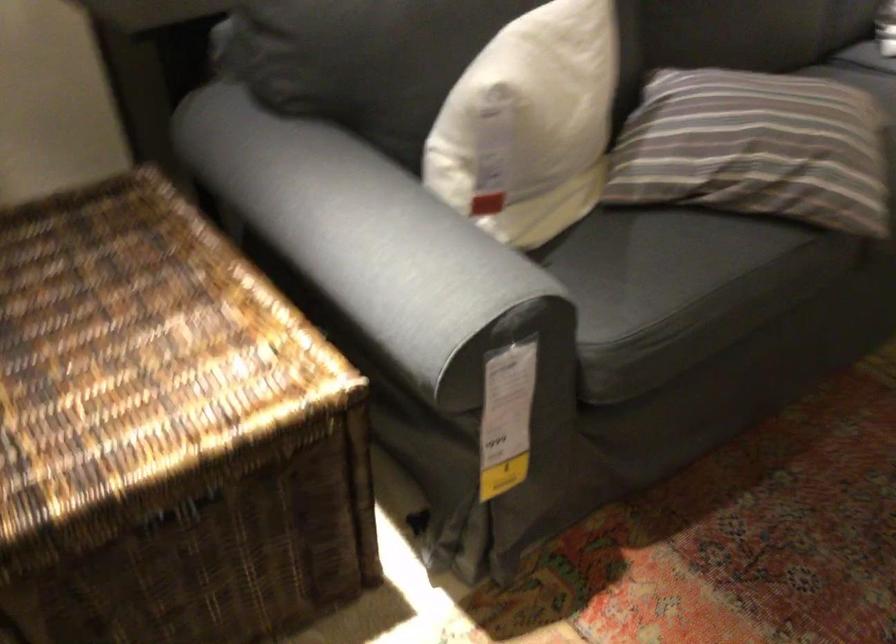
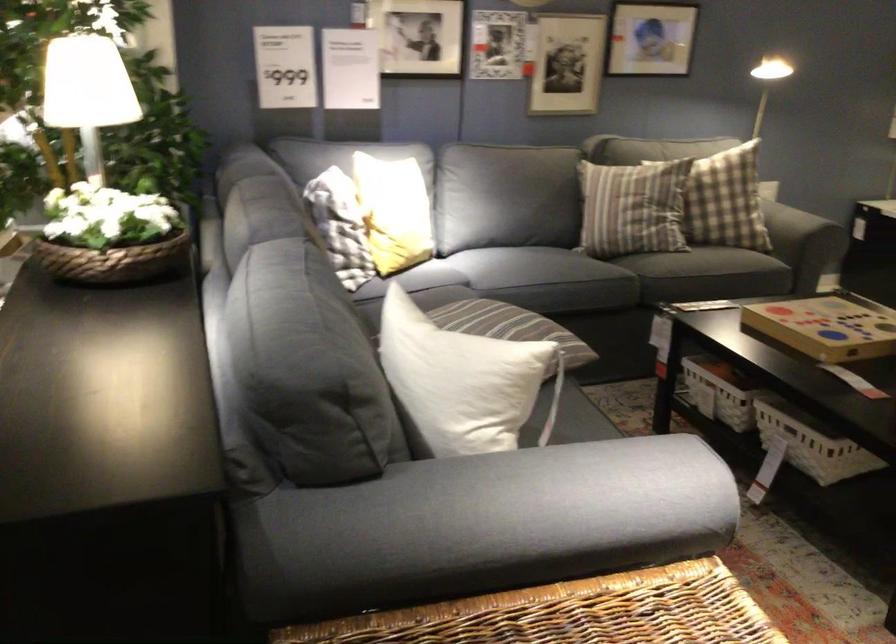
Locate, in the second image, the point that corresponds to [436,124] in the first image.

(462, 381)